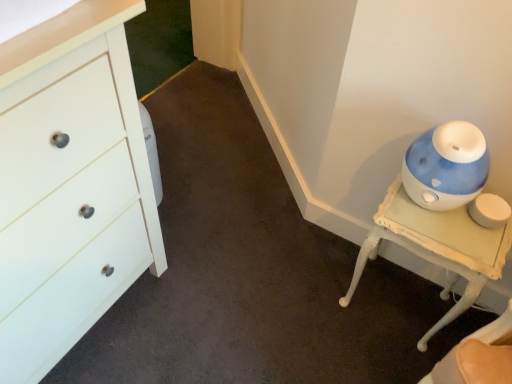
Where is `vacant position to the left of blue glossy humidifier at right`? vacant position to the left of blue glossy humidifier at right is located at coordinates pyautogui.click(x=308, y=295).